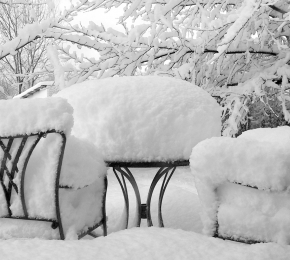
This screenshot has height=260, width=290. Identify the location of chair leg. (105, 232).